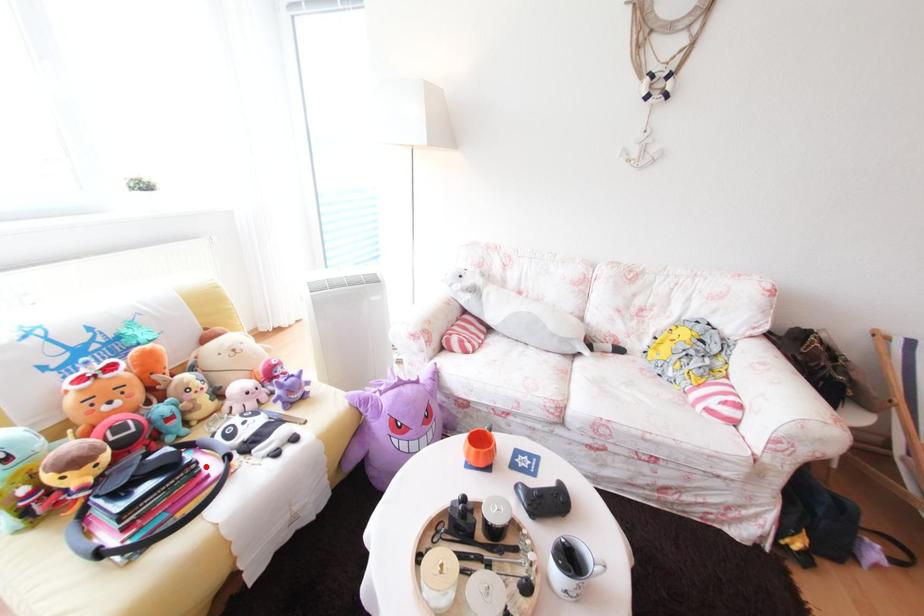
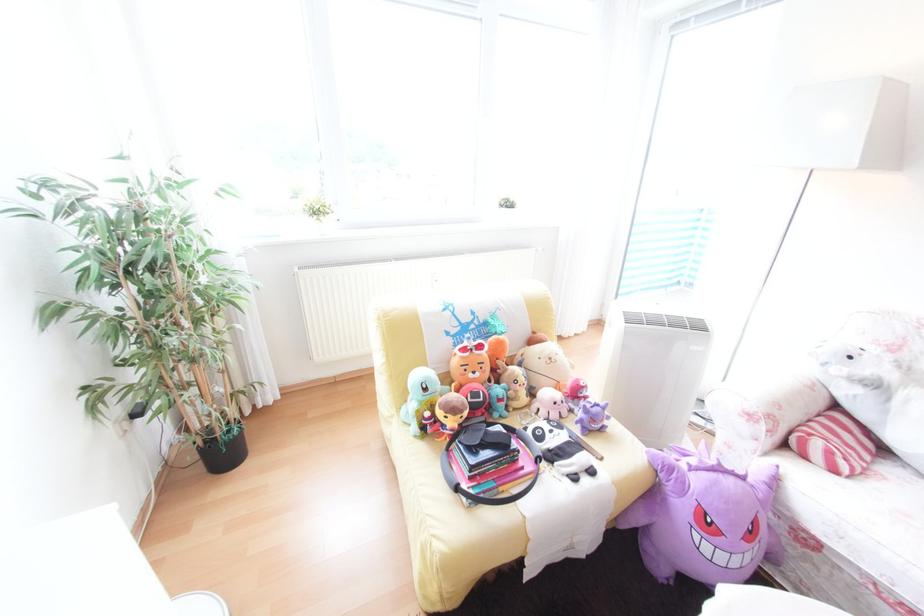
In the second image, find the point that corresponds to the highlighted location in the first image.

(526, 455)